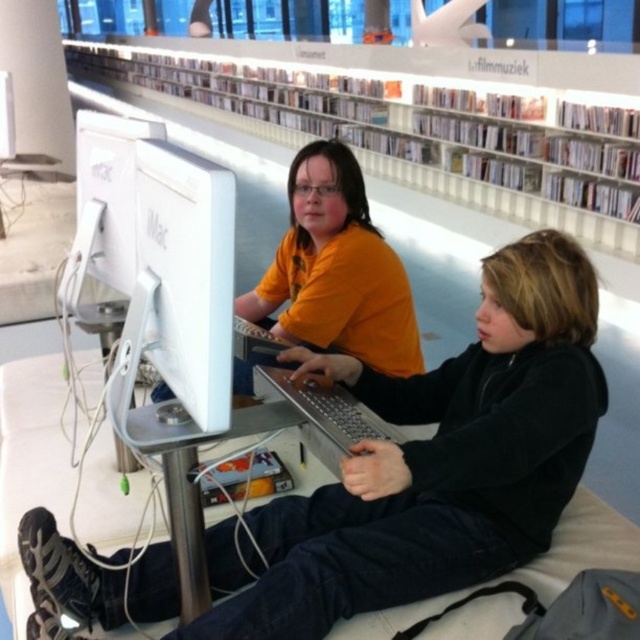
You are a librarian who needs to place a new book on the shelf. The book must be placed at the exact coordinates of point (x=349, y=140). Where should you place the book?

The book should be placed on the white plastic bookshelf at upper center at the coordinates of point (x=349, y=140).

You are a library visitor who wants to place a new book on the shelf. The book is the same size as the matte yellow shirt at center. Will the white plastic bookshelf at upper center have enough space to accommodate it?

The white plastic bookshelf at upper center is bigger than the matte yellow shirt at center, so yes, the book will fit on the shelf since the shelf is larger than the shirt.

In the scene shown: You are a librarian who needs to reach the white plastic bookshelf at upper center to retrieve a book. The white glossy monitor at center is in your way. Can you step around the monitor to access the bookshelf?

The white plastic bookshelf at upper center is positioned over the white glossy monitor at center, so you cannot step around the monitor to access the bookshelf because the bookshelf is directly above it.